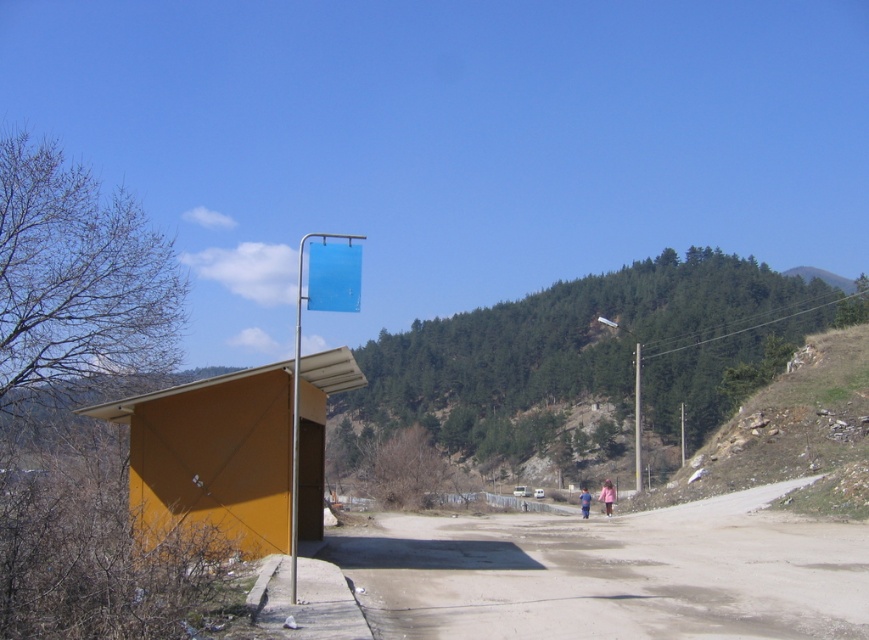
Question: Can you confirm if dirt road at center is smaller than metallic pole at center?

Choices:
 (A) yes
 (B) no

Answer: (A)

Question: Does blue plastic sign at center appear over metallic pole at center?

Choices:
 (A) no
 (B) yes

Answer: (B)

Question: Which of the following is the closest to the observer?

Choices:
 (A) dirt road at center
 (B) metallic pole at center

Answer: (A)

Question: Which object is closer to the camera taking this photo?

Choices:
 (A) dirt road at center
 (B) blue plastic sign at center
 (C) metallic pole at center

Answer: (A)

Question: Which point is closer to the camera taking this photo?

Choices:
 (A) (368, 550)
 (B) (634, 467)

Answer: (A)

Question: Can you confirm if blue plastic sign at center is positioned to the left of metallic pole at center?

Choices:
 (A) yes
 (B) no

Answer: (A)